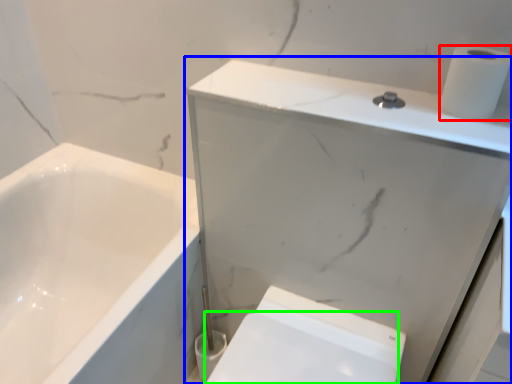
Question: Estimate the real-world distances between objects in this image. Which object is closer to toilet paper (highlighted by a red box), medicine cabinet (highlighted by a blue box) or bidet (highlighted by a green box)?

Choices:
 (A) medicine cabinet
 (B) bidet

Answer: (A)